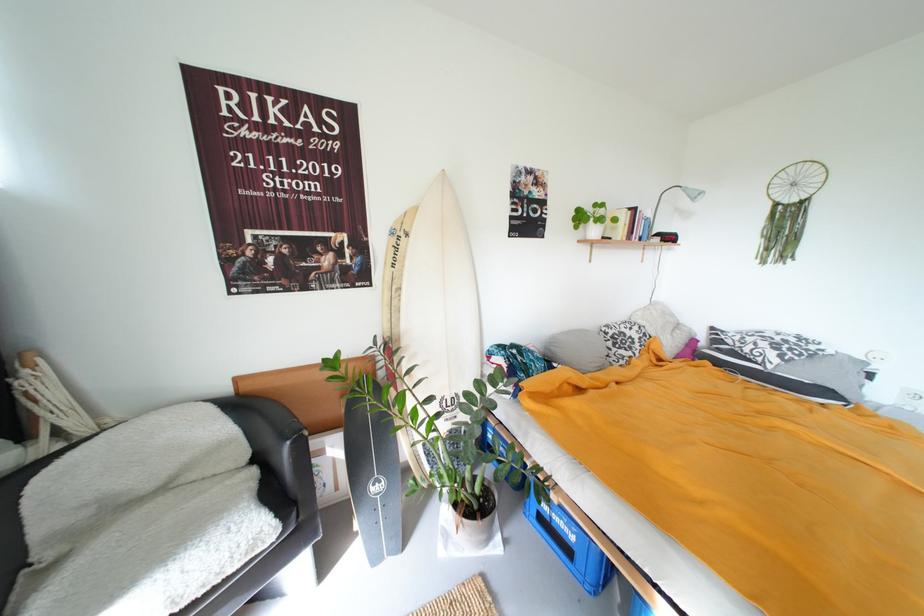
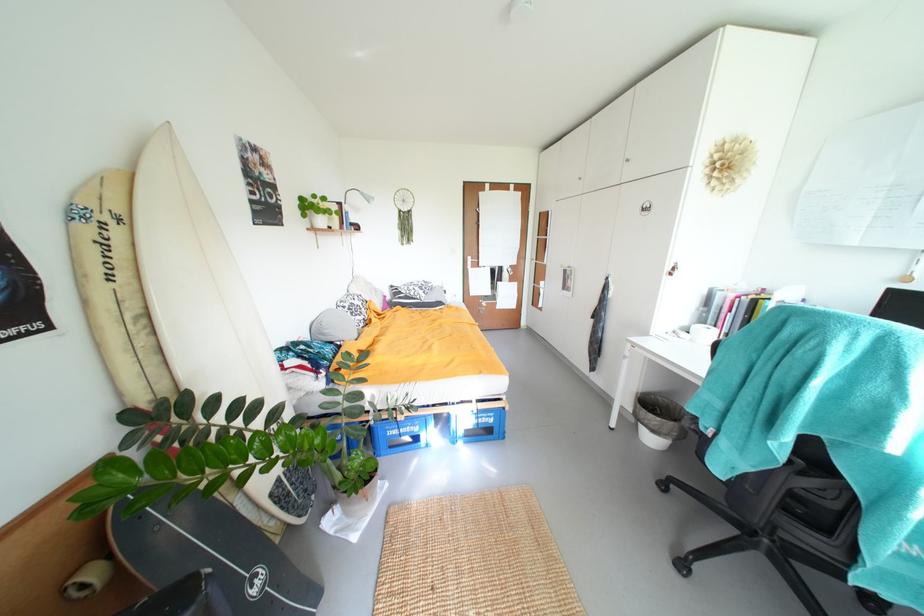
The point at (x=560, y=350) is marked in the first image. Where is the corresponding point in the second image?

(333, 333)